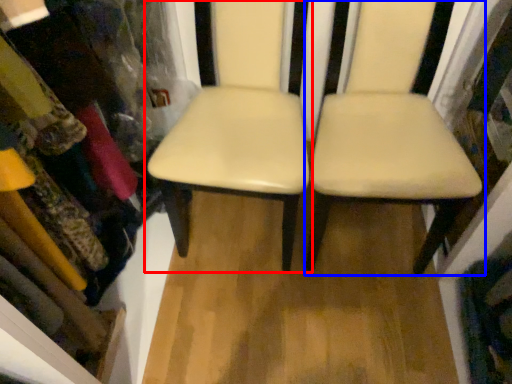
Question: Among these objects, which one is nearest to the camera, chair (highlighted by a red box) or chair (highlighted by a blue box)?

Choices:
 (A) chair
 (B) chair

Answer: (B)